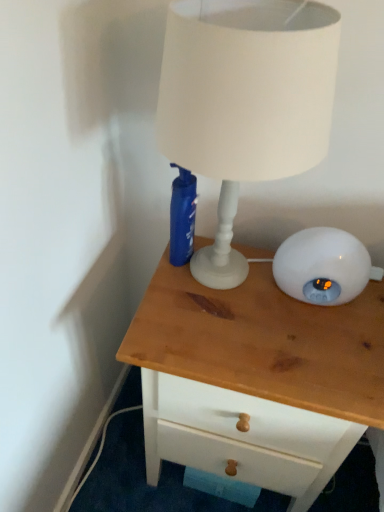
Question: From a real-world perspective, is wooden chest of drawers at center over white matte lampshade at upper center?

Choices:
 (A) no
 (B) yes

Answer: (A)

Question: Is wooden chest of drawers at center at the right side of white matte lampshade at upper center?

Choices:
 (A) no
 (B) yes

Answer: (B)

Question: From a real-world perspective, is wooden chest of drawers at center beneath white matte lampshade at upper center?

Choices:
 (A) yes
 (B) no

Answer: (A)

Question: Does wooden chest of drawers at center have a smaller size compared to white matte lampshade at upper center?

Choices:
 (A) no
 (B) yes

Answer: (A)

Question: Is wooden chest of drawers at center positioned behind white matte lampshade at upper center?

Choices:
 (A) yes
 (B) no

Answer: (A)

Question: Is wooden chest of drawers at center taller than white matte lampshade at upper center?

Choices:
 (A) no
 (B) yes

Answer: (B)

Question: Does white matte lampshade at upper center have a lesser width compared to wooden chest of drawers at center?

Choices:
 (A) no
 (B) yes

Answer: (B)

Question: Would you say white matte lampshade at upper center contains wooden chest of drawers at center?

Choices:
 (A) no
 (B) yes

Answer: (A)

Question: Considering the relative positions of white matte lampshade at upper center and wooden chest of drawers at center in the image provided, is white matte lampshade at upper center to the right of wooden chest of drawers at center from the viewer's perspective?

Choices:
 (A) yes
 (B) no

Answer: (B)

Question: Is the depth of white matte lampshade at upper center less than that of wooden chest of drawers at center?

Choices:
 (A) yes
 (B) no

Answer: (A)

Question: Is white matte lampshade at upper center turned away from wooden chest of drawers at center?

Choices:
 (A) yes
 (B) no

Answer: (B)

Question: Could you tell me if white matte lampshade at upper center is facing wooden chest of drawers at center?

Choices:
 (A) yes
 (B) no

Answer: (B)

Question: Considering the positions of point (256, 297) and point (226, 142), is point (256, 297) closer or farther from the camera than point (226, 142)?

Choices:
 (A) closer
 (B) farther

Answer: (B)